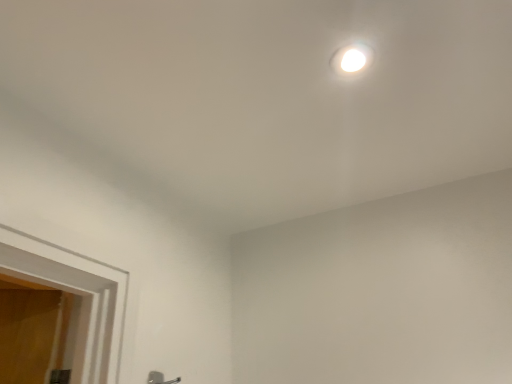
What is the approximate width of satin nickel door handle at lower center?

satin nickel door handle at lower center is 1.86 inches in width.

This screenshot has width=512, height=384. Describe the element at coordinates (160, 378) in the screenshot. I see `satin nickel door handle at lower center` at that location.

You are a GUI agent. You are given a task and a screenshot of the screen. Output one action in this format:
    pyautogui.click(x=<x>, y=<y>)
    Task: Click on the satin nickel door handle at lower center
    The width and height of the screenshot is (512, 384).
    Given the screenshot: What is the action you would take?
    pyautogui.click(x=160, y=378)

This screenshot has height=384, width=512. What do you see at coordinates (351, 59) in the screenshot?
I see `white glossy droplight at upper center` at bounding box center [351, 59].

In order to click on white glossy droplight at upper center in this screenshot , I will do `click(351, 59)`.

The width and height of the screenshot is (512, 384). In order to click on satin nickel door handle at lower center in this screenshot , I will do `click(160, 378)`.

Considering the positions of objects white glossy droplight at upper center and satin nickel door handle at lower center in the image provided, who is more to the left, white glossy droplight at upper center or satin nickel door handle at lower center?

Positioned to the left is satin nickel door handle at lower center.

In the scene shown: Considering the positions of objects white glossy droplight at upper center and satin nickel door handle at lower center in the image provided, who is behind, white glossy droplight at upper center or satin nickel door handle at lower center?

satin nickel door handle at lower center is behind.

Which point is more forward, (335, 53) or (151, 379)?

The point (335, 53) is more forward.

From the image's perspective, who appears lower, white glossy droplight at upper center or satin nickel door handle at lower center?

satin nickel door handle at lower center, from the image's perspective.

From a real-world perspective, which is physically below, white glossy droplight at upper center or satin nickel door handle at lower center?

satin nickel door handle at lower center, from a real-world perspective.

Which of these two, white glossy droplight at upper center or satin nickel door handle at lower center, is thinner?

satin nickel door handle at lower center is thinner.

Between white glossy droplight at upper center and satin nickel door handle at lower center, which one has more height?

Standing taller between the two is satin nickel door handle at lower center.

Considering the sizes of objects white glossy droplight at upper center and satin nickel door handle at lower center in the image provided, who is smaller, white glossy droplight at upper center or satin nickel door handle at lower center?

With smaller size is white glossy droplight at upper center.

Based on the photo, is white glossy droplight at upper center located outside satin nickel door handle at lower center?

Yes, white glossy droplight at upper center is outside of satin nickel door handle at lower center.

Would you consider white glossy droplight at upper center to be distant from satin nickel door handle at lower center?

They are positioned close to each other.

Is white glossy droplight at upper center looking in the opposite direction of satin nickel door handle at lower center?

No, white glossy droplight at upper center's orientation is not away from satin nickel door handle at lower center.

Can you tell me how much white glossy droplight at upper center and satin nickel door handle at lower center differ in facing direction?

There is a 3.3-degree angle between the facing directions of white glossy droplight at upper center and satin nickel door handle at lower center.

Identify the location of droplight located above the satin nickel door handle at lower center (from the image's perspective). (351, 59).

Is satin nickel door handle at lower center at the right side of white glossy droplight at upper center?

In fact, satin nickel door handle at lower center is to the left of white glossy droplight at upper center.

Between satin nickel door handle at lower center and white glossy droplight at upper center, which one is positioned in front?

white glossy droplight at upper center.

Is point (157, 375) positioned behind point (364, 61)?

Yes.

From the picture: From the image's perspective, is satin nickel door handle at lower center located above white glossy droplight at upper center?

No, from the image's perspective, satin nickel door handle at lower center is not over white glossy droplight at upper center.

From a real-world perspective, is satin nickel door handle at lower center above or below white glossy droplight at upper center?

In terms of real-world spatial position, satin nickel door handle at lower center is below white glossy droplight at upper center.

Is satin nickel door handle at lower center thinner than white glossy droplight at upper center?

Indeed, satin nickel door handle at lower center has a lesser width compared to white glossy droplight at upper center.

Can you confirm if satin nickel door handle at lower center is taller than white glossy droplight at upper center?

Yes.

Is satin nickel door handle at lower center bigger than white glossy droplight at upper center?

Yes.

Can white glossy droplight at upper center be found inside satin nickel door handle at lower center?

No, satin nickel door handle at lower center does not contain white glossy droplight at upper center.

Is satin nickel door handle at lower center next to white glossy droplight at upper center and touching it?

No, satin nickel door handle at lower center is not beside white glossy droplight at upper center.

Is satin nickel door handle at lower center aimed at white glossy droplight at upper center?

No, satin nickel door handle at lower center is not oriented towards white glossy droplight at upper center.

What are the coordinates of `door handle below the white glossy droplight at upper center (from the image's perspective)` in the screenshot? It's located at click(160, 378).

The height and width of the screenshot is (384, 512). Identify the location of droplight above the satin nickel door handle at lower center (from a real-world perspective). (351, 59).

Image resolution: width=512 pixels, height=384 pixels. What are the coordinates of `door handle below the white glossy droplight at upper center (from the image's perspective)` in the screenshot? It's located at (160, 378).